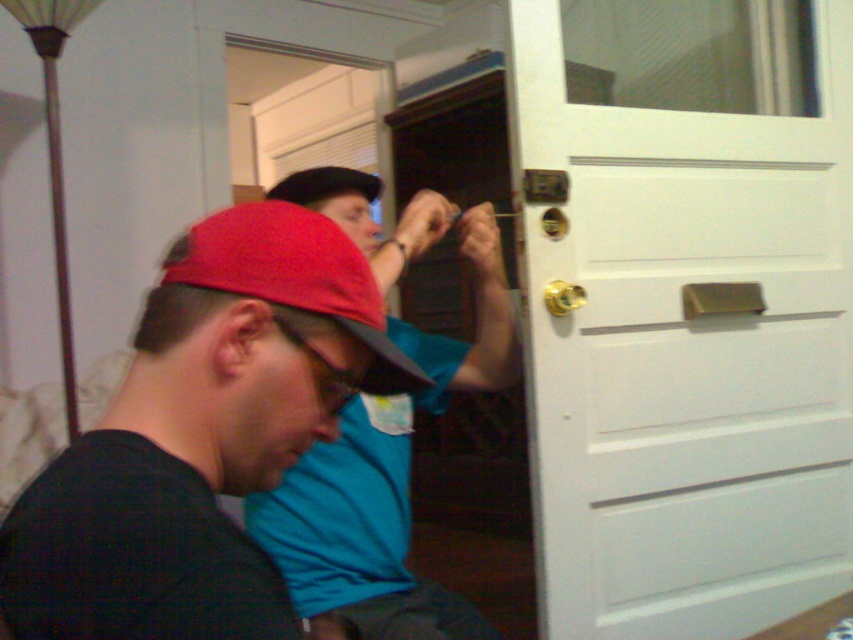
Question: Which of the following is the farthest from the observer?

Choices:
 (A) (392, 554)
 (B) (218, 282)
 (C) (218, 308)

Answer: (A)

Question: Which of the following is the farthest from the observer?

Choices:
 (A) gold metallic door handle at center right
 (B) red fabric cap at center

Answer: (A)

Question: Can you confirm if white painted wood door at center right is positioned above gold metallic door handle at center?

Choices:
 (A) yes
 (B) no

Answer: (A)

Question: Is white painted wood door at center right bigger than matte black cap at center?

Choices:
 (A) no
 (B) yes

Answer: (B)

Question: Estimate the real-world distances between objects in this image. Which object is closer to the white painted wood door at center right?

Choices:
 (A) gold metallic door handle at center right
 (B) red fabric cap at center
 (C) gold metallic door handle at center
 (D) matte black cap at center

Answer: (C)

Question: Can you confirm if white painted wood door at center right is thinner than gold metallic door handle at center right?

Choices:
 (A) yes
 (B) no

Answer: (B)